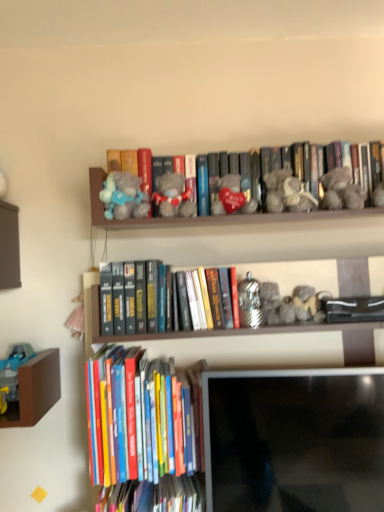
Question: Is hardcover books at lower left, the second book viewed from the top, facing towards fuzzy gray teddy bear at upper right, the fourth toy when ordered from left to right?

Choices:
 (A) no
 (B) yes

Answer: (A)

Question: Is the depth of hardcover books at lower left, the second book viewed from the top, less than that of fuzzy gray teddy bear at upper right, which is the first toy in right-to-left order?

Choices:
 (A) yes
 (B) no

Answer: (A)

Question: Can you confirm if hardcover books at lower left, positioned as the 2th book in bottom-to-top order, is positioned to the right of fuzzy gray teddy bear at upper right, the fourth toy when ordered from left to right?

Choices:
 (A) no
 (B) yes

Answer: (A)

Question: Can you confirm if hardcover books at lower left, positioned as the 2th book in bottom-to-top order, is thinner than fuzzy gray teddy bear at upper right, which is the first toy in right-to-left order?

Choices:
 (A) yes
 (B) no

Answer: (B)

Question: Is hardcover books at lower left, positioned as the 2th book in bottom-to-top order, shorter than fuzzy gray teddy bear at upper right, which is the first toy in right-to-left order?

Choices:
 (A) no
 (B) yes

Answer: (A)

Question: Considering the relative positions of hardcover book at lower center, which is the 1th book in bottom-to-top order, and matte black monitor at lower center in the image provided, is hardcover book at lower center, which is the 1th book in bottom-to-top order, to the left or to the right of matte black monitor at lower center?

Choices:
 (A) right
 (B) left

Answer: (B)

Question: Looking at the image, does hardcover book at lower center, acting as the 3th book starting from the top, seem bigger or smaller compared to matte black monitor at lower center?

Choices:
 (A) small
 (B) big

Answer: (A)

Question: Considering the positions of hardcover book at lower center, acting as the 3th book starting from the top, and matte black monitor at lower center in the image, is hardcover book at lower center, acting as the 3th book starting from the top, taller or shorter than matte black monitor at lower center?

Choices:
 (A) short
 (B) tall

Answer: (A)

Question: In terms of width, does hardcover book at lower center, acting as the 3th book starting from the top, look wider or thinner when compared to matte black monitor at lower center?

Choices:
 (A) thin
 (B) wide

Answer: (B)

Question: Would you say fluffy gray teddy bear at upper center, the first toy positioned from the left, is inside or outside gray plush bear at center, which is the 1th book in top-to-bottom order?

Choices:
 (A) outside
 (B) inside

Answer: (A)

Question: Is fluffy gray teddy bear at upper center, the first toy positioned from the left, in front of or behind gray plush bear at center, which is the 1th book in top-to-bottom order, in the image?

Choices:
 (A) front
 (B) behind

Answer: (A)

Question: Is point (124, 180) positioned closer to the camera than point (92, 182)?

Choices:
 (A) farther
 (B) closer

Answer: (A)

Question: Considering the relative positions of fluffy gray teddy bear at upper center, the first toy positioned from the left, and gray plush bear at center, the third book ordered from the bottom, in the image provided, is fluffy gray teddy bear at upper center, the first toy positioned from the left, to the left or to the right of gray plush bear at center, the third book ordered from the bottom,?

Choices:
 (A) left
 (B) right

Answer: (A)

Question: From a real-world perspective, is hardcover books at lower left, positioned as the 2th book in bottom-to-top order, above or below fluffy gray teddy bear at upper center, the fourth toy viewed from the right?

Choices:
 (A) above
 (B) below

Answer: (B)

Question: From the image's perspective, is hardcover books at lower left, positioned as the 2th book in bottom-to-top order, located above or below fluffy gray teddy bear at upper center, the fourth toy viewed from the right?

Choices:
 (A) below
 (B) above

Answer: (A)